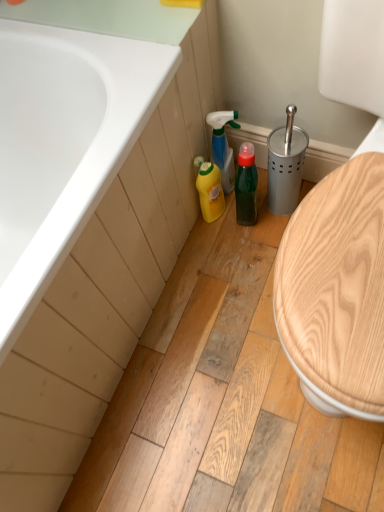
Question: In the image, is green matte bottle at center on the left side or the right side of yellow plastic bottle at lower center, the 2th cleaning product when ordered from top to bottom?

Choices:
 (A) left
 (B) right

Answer: (B)

Question: Do you think green matte bottle at center is within yellow plastic bottle at lower center, the 2th cleaning product when ordered from top to bottom, or outside of it?

Choices:
 (A) outside
 (B) inside

Answer: (A)

Question: Estimate the real-world distances between objects in this image. Which object is farther from the translucent green spray bottle at center, the first cleaning product positioned from the top?

Choices:
 (A) yellow plastic bottle at lower center, the 2th cleaning product when ordered from top to bottom
 (B) green matte bottle at center
 (C) white glossy bathtub at upper left

Answer: (C)

Question: Which object is the farthest from the white glossy bathtub at upper left?

Choices:
 (A) green matte bottle at center
 (B) yellow plastic bottle at lower center, the 2th cleaning product when ordered from top to bottom
 (C) translucent green spray bottle at center, the 2th cleaning product in the bottom-to-top sequence

Answer: (A)